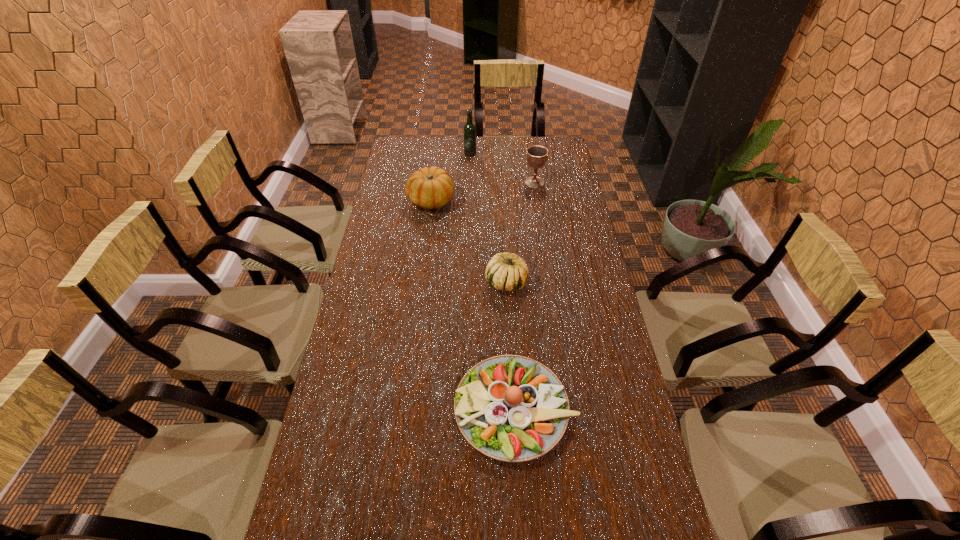
The height and width of the screenshot is (540, 960). I want to click on vacant space at the right edge, so click(x=593, y=387).

At what (x,y) coordinates should I click in order to perform the action: click on free space at the far left corner of the desktop. Please return your answer as a coordinate pair (x, y). Looking at the image, I should click on (410, 153).

At what (x,y) coordinates should I click in order to perform the action: click on unoccupied position between the leftmost object and the beer bottle. Please return your answer as a coordinate pair (x, y). The image size is (960, 540). Looking at the image, I should click on (450, 177).

Where is `free space between the beer bottle and the farther gourd`? free space between the beer bottle and the farther gourd is located at coordinates (450, 177).

Image resolution: width=960 pixels, height=540 pixels. What are the coordinates of `free space between the nearest object and the nearer gourd` in the screenshot? It's located at (511, 345).

This screenshot has height=540, width=960. In order to click on free space between the fourth farthest object and the salad plate in this screenshot , I will do `click(511, 345)`.

Where is `object that is the second nearest to the chalice`? The image size is (960, 540). object that is the second nearest to the chalice is located at coordinates (429, 188).

Find the location of a particular element. Image resolution: width=960 pixels, height=540 pixels. object that stands as the second closest to the leftmost object is located at coordinates (537, 156).

Find the location of a particular element. vacant position in the image that satisfies the following two spatial constraints: 1. on the back side of the farther gourd; 2. on the left side of the chalice is located at coordinates (433, 183).

You are a GUI agent. You are given a task and a screenshot of the screen. Output one action in this format:
    pyautogui.click(x=<x>, y=<y>)
    Task: Click on the vacant region that satisfies the following two spatial constraints: 1. on the back side of the nearest object; 2. on the right side of the chalice
    The width and height of the screenshot is (960, 540).
    Given the screenshot: What is the action you would take?
    pyautogui.click(x=502, y=183)